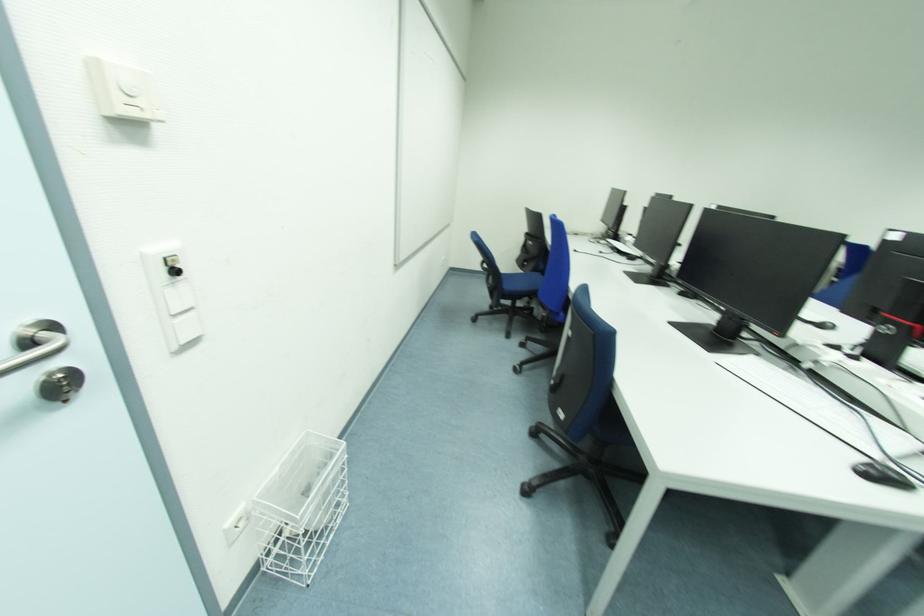
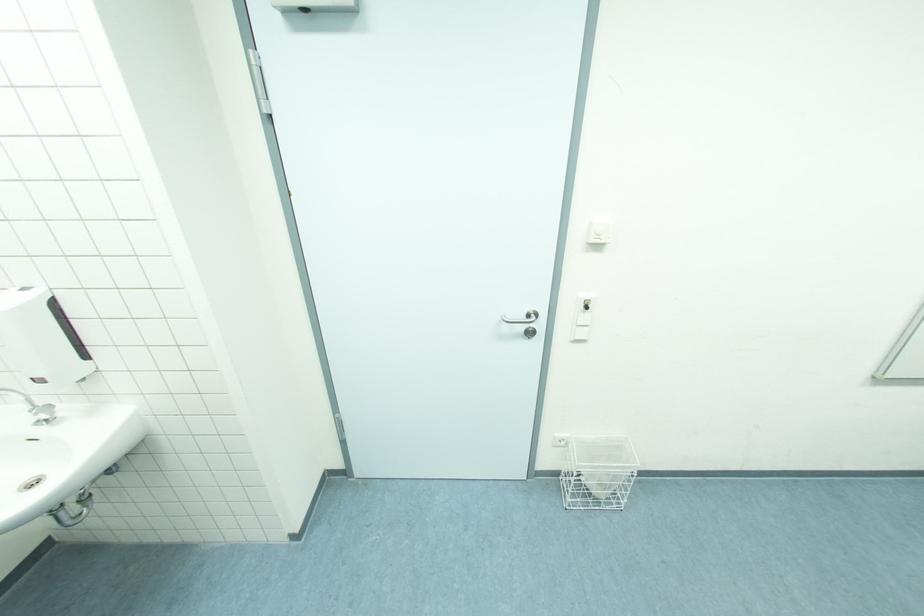
Where in the second image is the point corresponding to the point at 177,317 from the first image?

(580, 328)